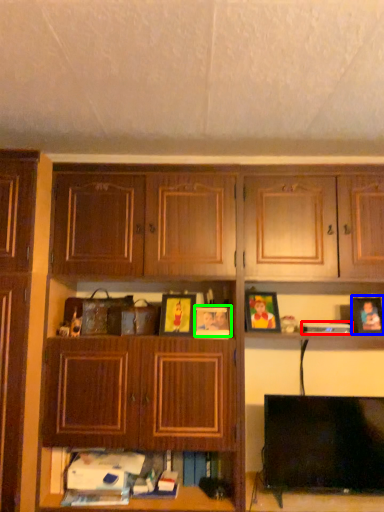
Question: Considering the real-world distances, which object is closest to book (highlighted by a red box)? picture frame (highlighted by a blue box) or picture frame (highlighted by a green box).

Choices:
 (A) picture frame
 (B) picture frame

Answer: (A)